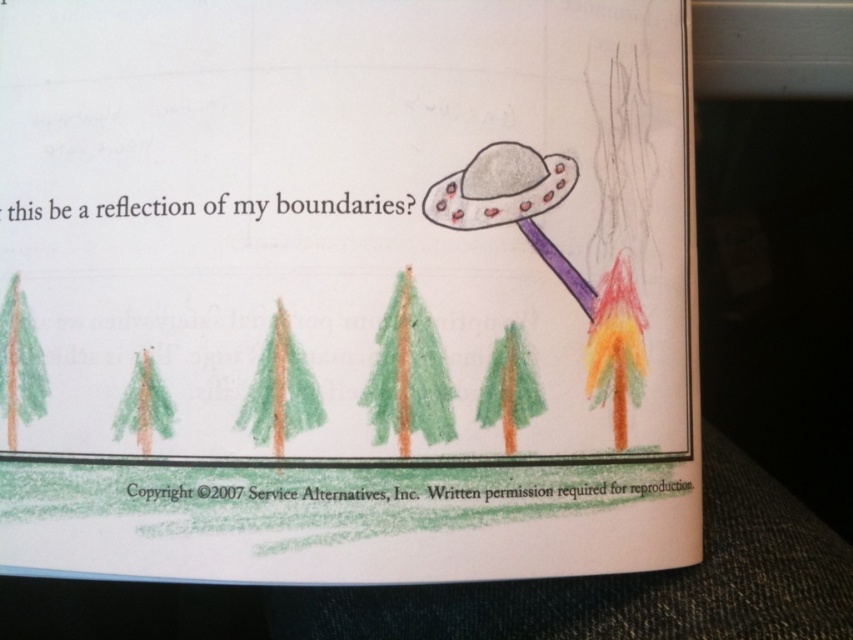
Who is positioned more to the left, green crayon tree at left or green crayon tree at center?

From the viewer's perspective, green crayon tree at left appears more on the left side.

Find the location of `green crayon tree at left`. green crayon tree at left is located at coordinates (19, 364).

Is point (268, 397) closer to camera compared to point (44, 394)?

Yes.

Which of these two, green matte tree at center or green crayon tree at left, stands shorter?

Standing shorter between the two is green matte tree at center.

Who is more forward, (267,438) or (12,387)?

Point (267,438) is more forward.

Locate an element on the screen. green matte tree at center is located at coordinates (280, 388).

Does point (389, 422) lie in front of point (161, 413)?

Yes, it is.

Between green textured tree at center and green pastel tree at left, which one appears on the right side from the viewer's perspective?

From the viewer's perspective, green textured tree at center appears more on the right side.

Find the location of a particular element. Image resolution: width=853 pixels, height=640 pixels. green textured tree at center is located at coordinates (408, 372).